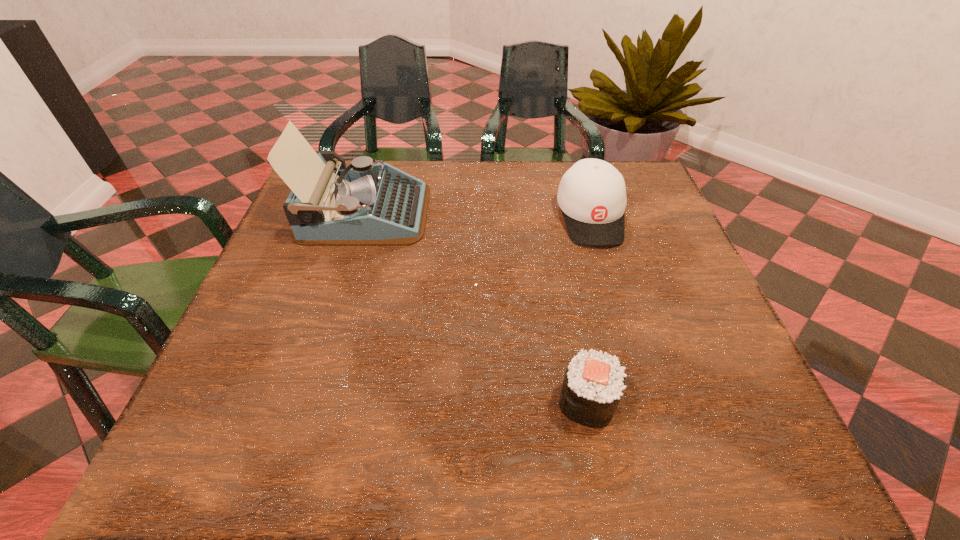
The width and height of the screenshot is (960, 540). Find the location of `vacant space that is in between the typewriter and the shortest object`. vacant space that is in between the typewriter and the shortest object is located at coordinates (476, 307).

The image size is (960, 540). I want to click on free space that is in between the tallest object and the shortest object, so click(476, 307).

The height and width of the screenshot is (540, 960). I want to click on vacant region between the baseball cap and the shortest object, so click(x=588, y=309).

The height and width of the screenshot is (540, 960). In order to click on empty location between the nearest object and the typewriter in this screenshot , I will do `click(476, 307)`.

The height and width of the screenshot is (540, 960). I want to click on free space between the second tallest object and the shortest object, so click(588, 309).

Where is `empty space that is in between the baseball cap and the leftmost object`? The height and width of the screenshot is (540, 960). empty space that is in between the baseball cap and the leftmost object is located at coordinates (477, 214).

This screenshot has width=960, height=540. Find the location of `vacant space that is in between the baseball cap and the typewriter`. vacant space that is in between the baseball cap and the typewriter is located at coordinates (477, 214).

You are a GUI agent. You are given a task and a screenshot of the screen. Output one action in this format:
    pyautogui.click(x=<x>, y=<y>)
    Task: Click on the vacant space in between the sushi and the typewriter
    The width and height of the screenshot is (960, 540).
    Given the screenshot: What is the action you would take?
    pyautogui.click(x=476, y=307)

What are the coordinates of `empty space that is in between the sushi and the leftmost object` in the screenshot? It's located at click(x=476, y=307).

At what (x,y) coordinates should I click in order to perform the action: click on free space between the sushi and the second tallest object. Please return your answer as a coordinate pair (x, y). The height and width of the screenshot is (540, 960). Looking at the image, I should click on (588, 309).